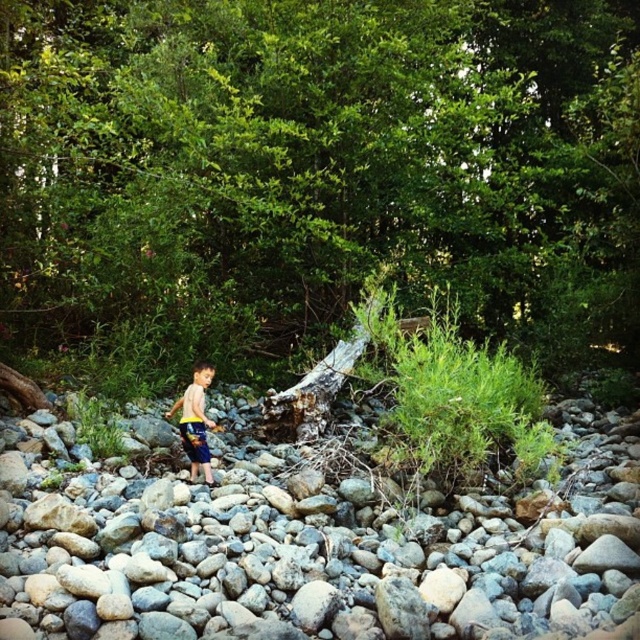
Question: Is smooth gray rocks at center further to the viewer compared to yellow-blue shorts at center?

Choices:
 (A) yes
 (B) no

Answer: (B)

Question: Can you confirm if smooth gray rocks at center is smaller than yellow-blue shorts at center?

Choices:
 (A) yes
 (B) no

Answer: (B)

Question: Can you confirm if smooth gray rocks at center is thinner than yellow-blue shorts at center?

Choices:
 (A) yes
 (B) no

Answer: (B)

Question: Which of the following is the farthest from the observer?

Choices:
 (A) smooth gray rocks at center
 (B) yellow-blue shorts at center

Answer: (B)